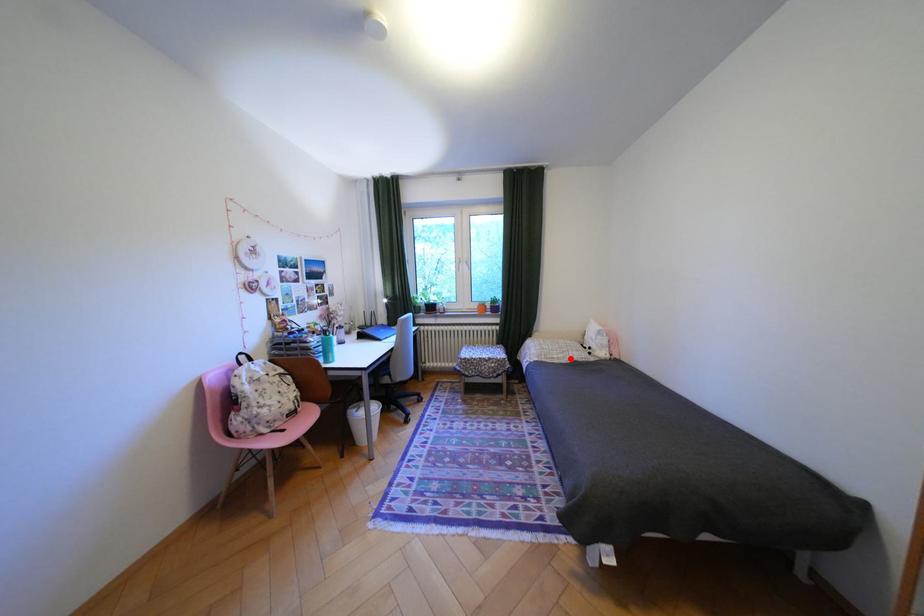
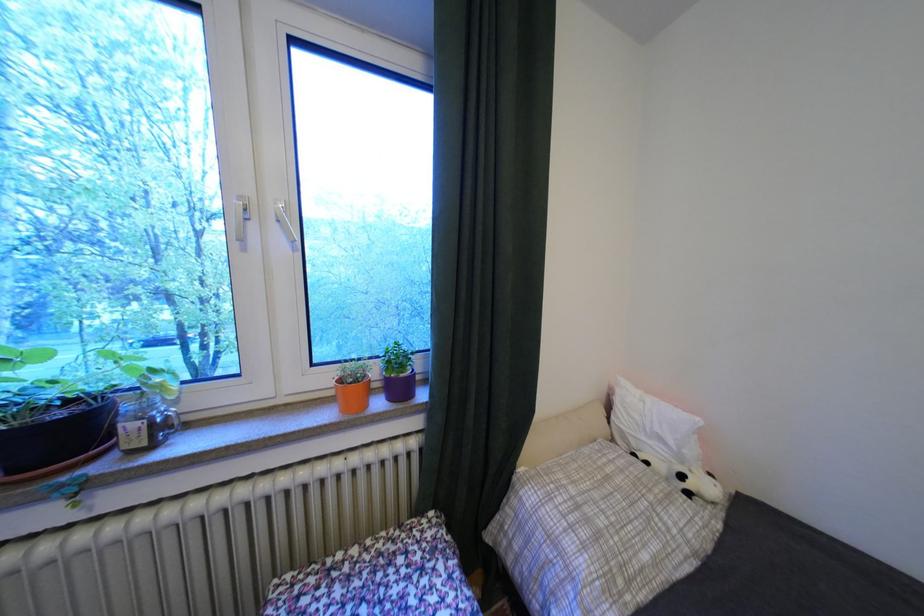
Where in the second image is the point corresponding to the highlighted location from the first image?

(667, 562)